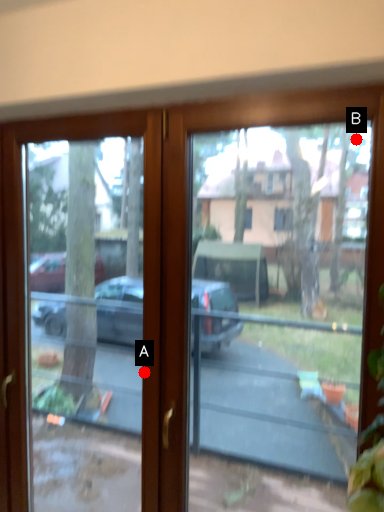
Question: Two points are circled on the image, labeled by A and B beside each circle. Which point is farther from the camera taking this photo?

Choices:
 (A) A is further
 (B) B is further

Answer: (A)